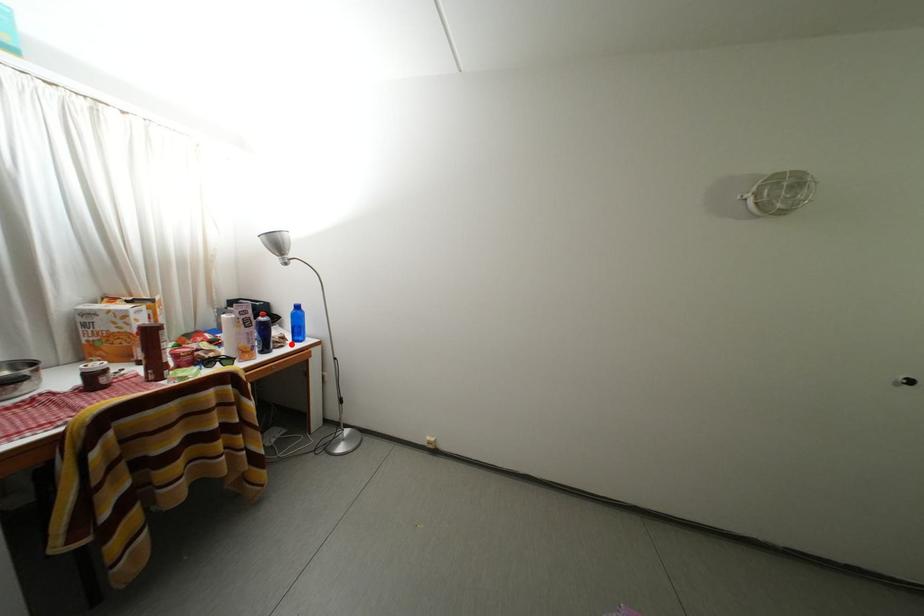
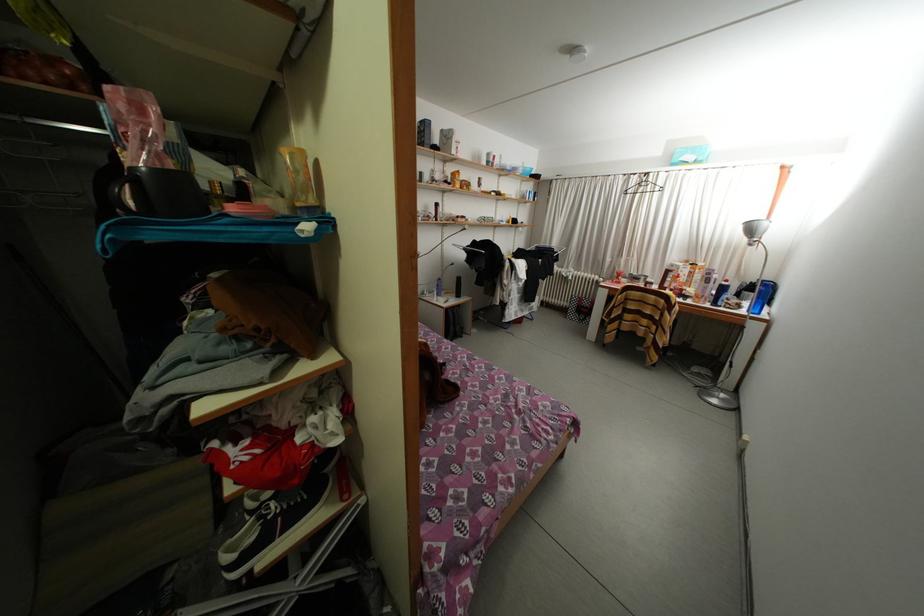
Find the pixel in the second image that matches the highlighted location in the first image.

(747, 310)